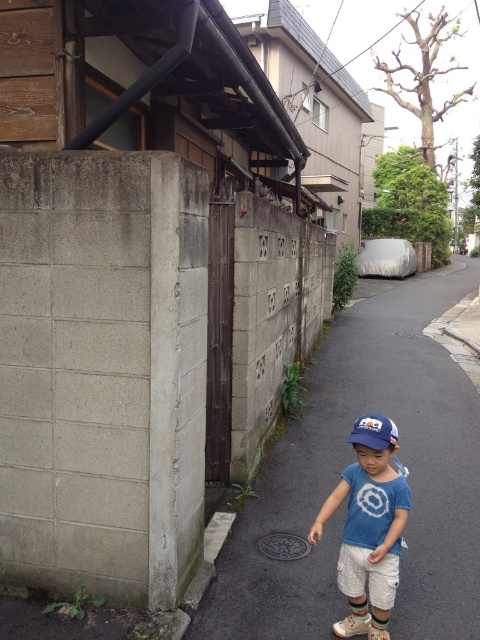
Can you confirm if dark asphalt pavement at lower center is shorter than blue cotton shirt at center?

Incorrect, dark asphalt pavement at lower center's height does not fall short of blue cotton shirt at center's.

How much distance is there between dark asphalt pavement at lower center and blue cotton shirt at center?

dark asphalt pavement at lower center is 2.02 meters from blue cotton shirt at center.

Find the location of `dark asphalt pavement at lower center`. dark asphalt pavement at lower center is located at coordinates (350, 461).

Can you confirm if blue cotton shirt at center is positioned above blue fabric baseball cap at center?

No.

The image size is (480, 640). What do you see at coordinates (369, 525) in the screenshot?
I see `blue cotton shirt at center` at bounding box center [369, 525].

The height and width of the screenshot is (640, 480). What are the coordinates of `blue cotton shirt at center` in the screenshot? It's located at (369, 525).

I want to click on blue cotton shirt at center, so click(x=369, y=525).

Does point (464, 460) lie in front of point (365, 442)?

No, it is not.

Between dark asphalt pavement at lower center and blue fabric baseball cap at center, which one has less height?

With less height is blue fabric baseball cap at center.

You are a GUI agent. You are given a task and a screenshot of the screen. Output one action in this format:
    pyautogui.click(x=<x>, y=<y>)
    Task: Click on the dark asphalt pavement at lower center
    The height and width of the screenshot is (640, 480).
    Given the screenshot: What is the action you would take?
    pyautogui.click(x=350, y=461)